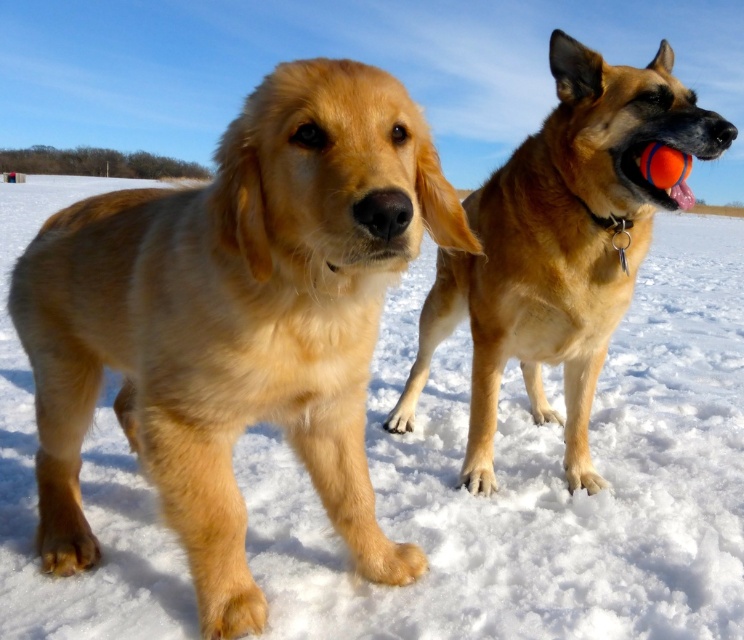
Question: Which of the following is the farthest from the observer?

Choices:
 (A) (420, 180)
 (B) (548, 244)

Answer: (B)

Question: Is golden fur dog at center thinner than golden fur dog at right?

Choices:
 (A) yes
 (B) no

Answer: (B)

Question: Among these points, which one is nearest to the camera?

Choices:
 (A) (493, 230)
 (B) (359, 253)

Answer: (B)

Question: Among these points, which one is nearest to the camera?

Choices:
 (A) (583, 84)
 (B) (57, 460)

Answer: (B)

Question: Can you confirm if golden fur dog at center is positioned below golden fur dog at right?

Choices:
 (A) no
 (B) yes

Answer: (B)

Question: Can you confirm if golden fur dog at center is positioned to the right of golden fur dog at right?

Choices:
 (A) no
 (B) yes

Answer: (A)